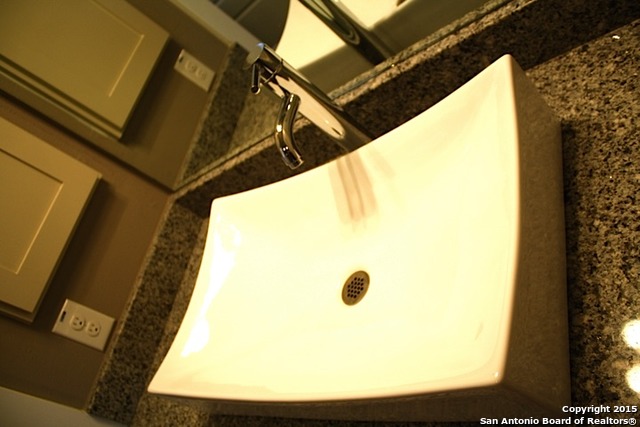
In order to click on reflection of lights in this screenshot , I will do `click(636, 379)`, `click(634, 341)`.